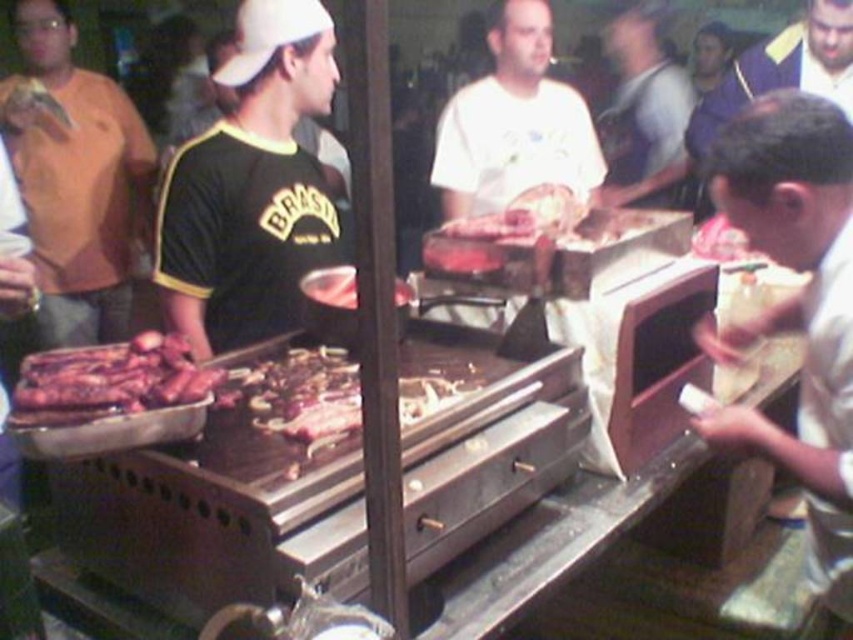
You are standing at the food stall and want to place two items on the grill. The first item is at point A, which is at coordinates point (183, 289), and the second item is at point B, which is at coordinates point (79, 387). Which point is closer to the front of the grill?

Point B at coordinates point (79, 387) is closer to the front of the grill because it is in front of point A at coordinates point (183, 289).

You are a customer at the food stall and want to order from the shiny brown ribs at left. The vendor is wearing the black matte jersey at center. Which direction should you approach from to give your order?

The black matte jersey at center is positioned on the right side of the shiny brown ribs at left, so you should approach from the left side of the shiny brown ribs at left to reach the vendor wearing the black matte jersey at center.

You are a customer at the food stall and want to know which staff member is closer to the grill. The staff members are the matte orange shirt at left and the white matte shirt at center. Can you determine which one is closer?

The white matte shirt at center is closer to the grill because the matte orange shirt at left is bigger than white matte shirt at center, which often indicates proximity in such scenes.